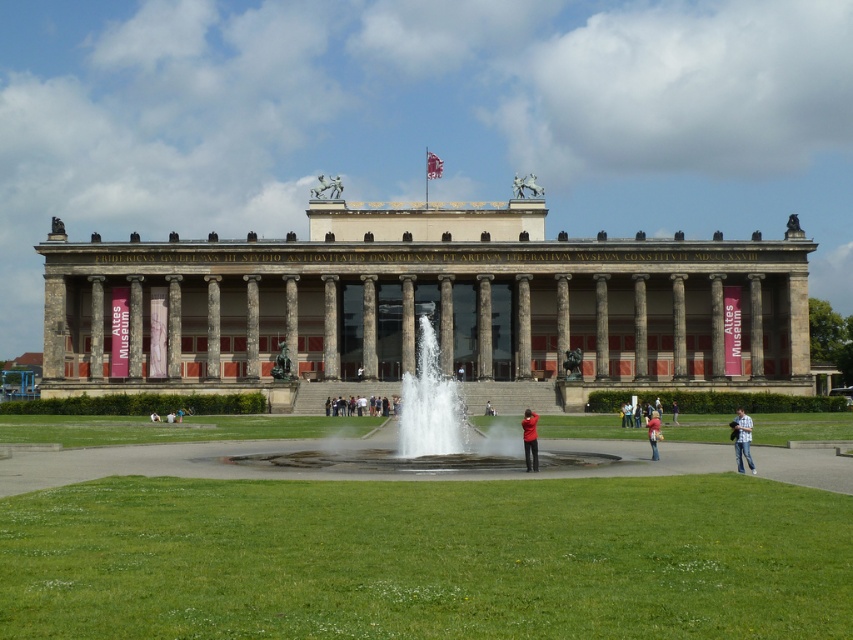
You are standing in front of the Altes Museum in Berlin and see the red matte jacket at center. If you want to take a photo of the museum without the jacket blocking the view, where should you move relative to the jacket?

To avoid the red matte jacket at center blocking the view, move to either the left or right side since the jacket is centrally located at point (529, 438).

You are standing in front of the Altes Museum in Berlin and want to take a photo. You notice two points marked in the scene. The first point is at coordinates point (556, 358) and the second is at point (737, 428). Which point is closer to your camera lens?

Point (556, 358) is further to the camera than point (737, 428). Therefore, the point closer to your camera lens is point (556, 358).